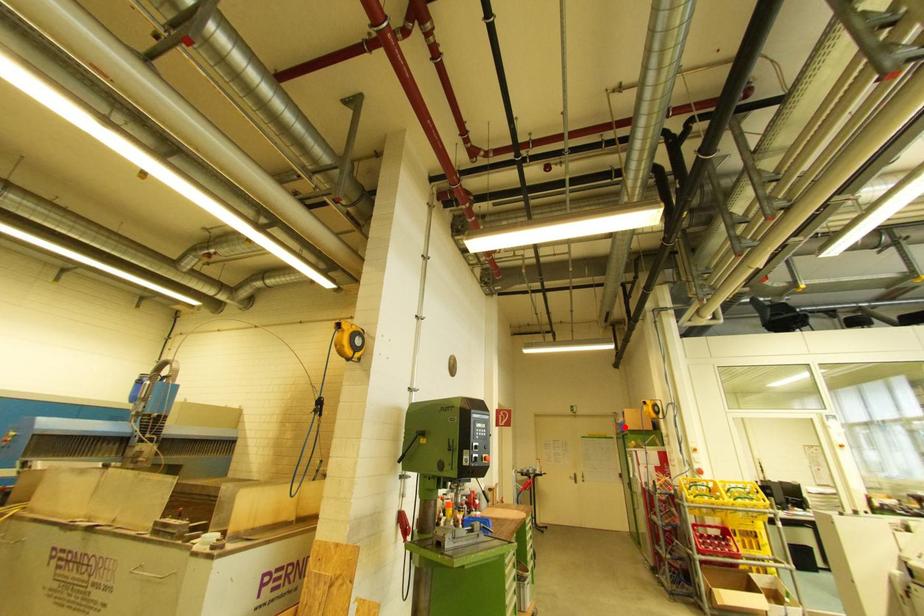
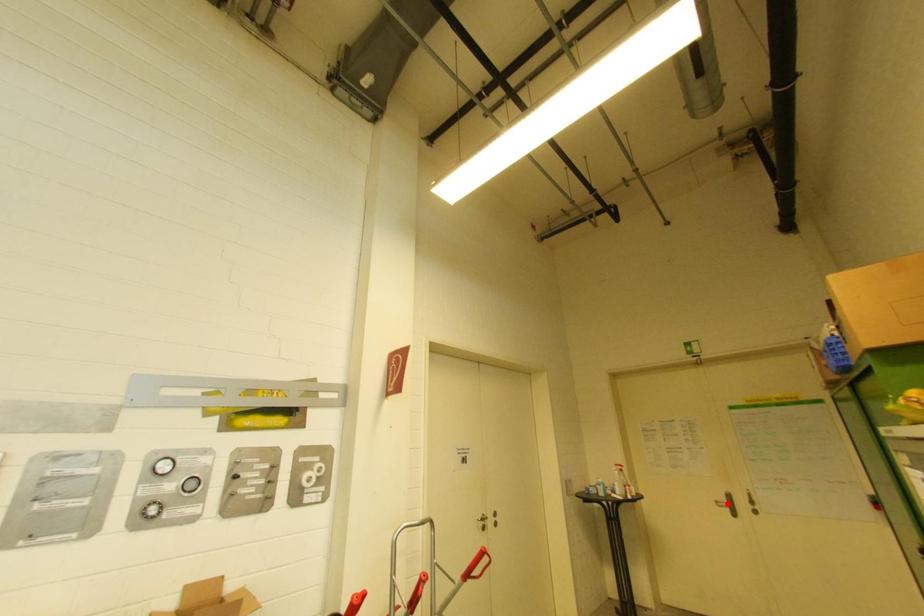
I am providing you with two images of the same scene from different viewpoints. A red point is marked on the first image and another point is marked on the second image. Is the red point in image1 aligned with the point shown in image2?

No